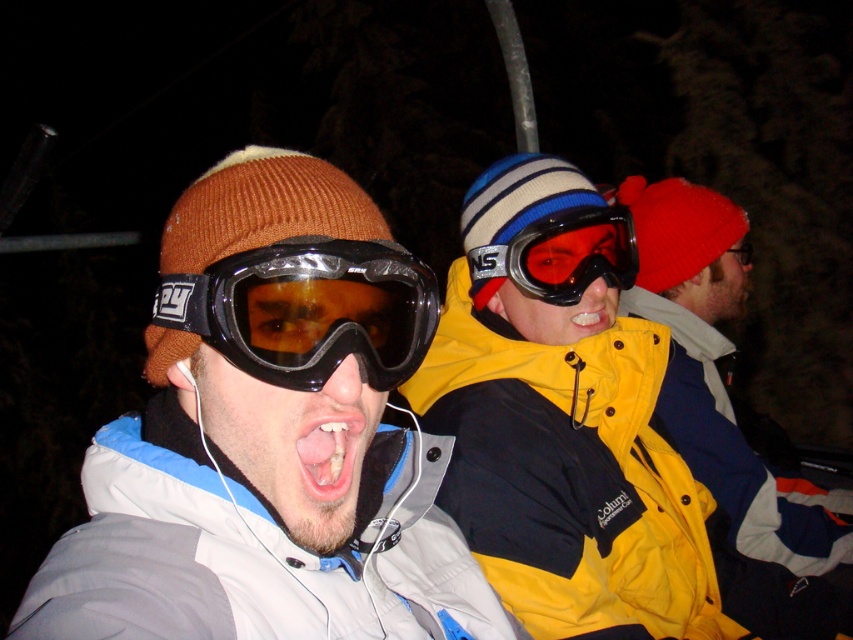
Which is below, matte yellow jacket at right or black matte goggles at center?

matte yellow jacket at right

Between matte yellow jacket at right and black matte goggles at center, which one is positioned higher?

black matte goggles at center is higher up.

Between point (698, 268) and point (164, 307), which one is positioned behind?

Point (698, 268)

Where is `matte yellow jacket at right`? This screenshot has width=853, height=640. matte yellow jacket at right is located at coordinates (718, 372).

Between matte gray jacket at center and black matte goggles at center, which one has more height?

matte gray jacket at center is taller.

This screenshot has height=640, width=853. I want to click on matte gray jacket at center, so click(x=267, y=436).

Find the location of `matte gray jacket at center`. matte gray jacket at center is located at coordinates (267, 436).

Locate an element on the screen. The height and width of the screenshot is (640, 853). transparent plastic goggles at center is located at coordinates (563, 253).

Is point (567, 227) in front of point (303, 429)?

That is False.

This screenshot has height=640, width=853. Identify the location of transparent plastic goggles at center. (563, 253).